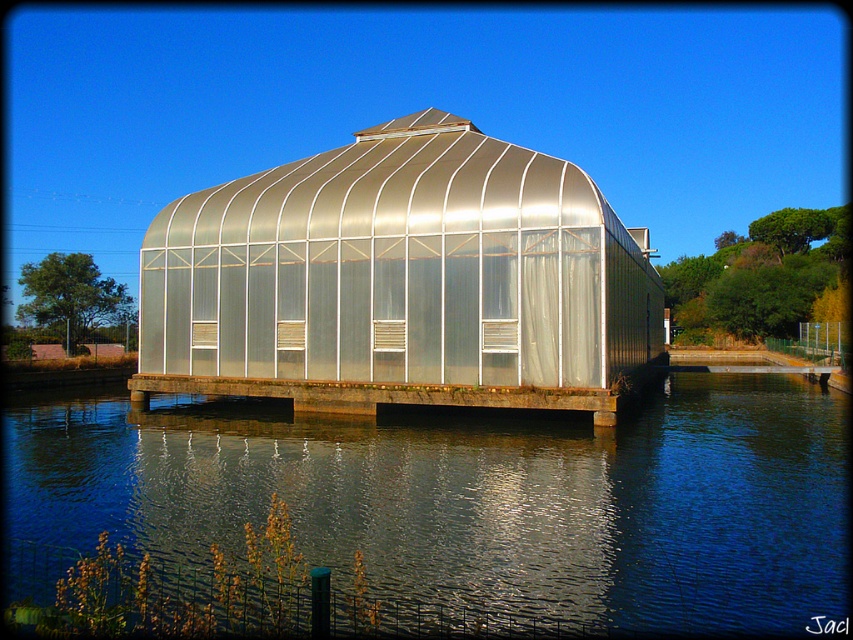
Describe the element at coordinates (479, 497) in the screenshot. The width and height of the screenshot is (853, 640). I see `transparent water at center` at that location.

Does transparent water at center have a smaller size compared to transparent glass greenhouse at center?

Yes, transparent water at center is smaller than transparent glass greenhouse at center.

Describe the element at coordinates (479, 497) in the screenshot. I see `transparent water at center` at that location.

In order to click on transparent water at center in this screenshot , I will do `click(479, 497)`.

Which is above, transparent glass greenhouse at center or metallic concrete dock at center?

transparent glass greenhouse at center is above.

Is transparent glass greenhouse at center smaller than metallic concrete dock at center?

No.

The height and width of the screenshot is (640, 853). What do you see at coordinates (399, 280) in the screenshot?
I see `transparent glass greenhouse at center` at bounding box center [399, 280].

Find the location of a particular element. This screenshot has width=853, height=640. transparent glass greenhouse at center is located at coordinates (399, 280).

Between point (712, 499) and point (236, 380), which one is positioned behind?

Point (236, 380)

Is transparent water at center taller than metallic concrete dock at center?

Incorrect, transparent water at center's height is not larger of metallic concrete dock at center's.

Is point (627, 493) more distant than point (212, 376)?

No, it is not.

Identify the location of transparent water at center. Image resolution: width=853 pixels, height=640 pixels. point(479,497).